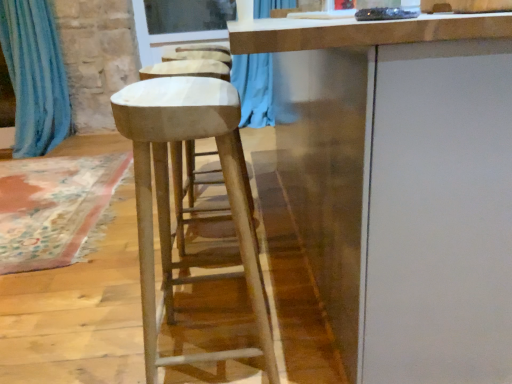
Find the location of `blank area to the left of smooth white stool at center`. blank area to the left of smooth white stool at center is located at coordinates (101, 342).